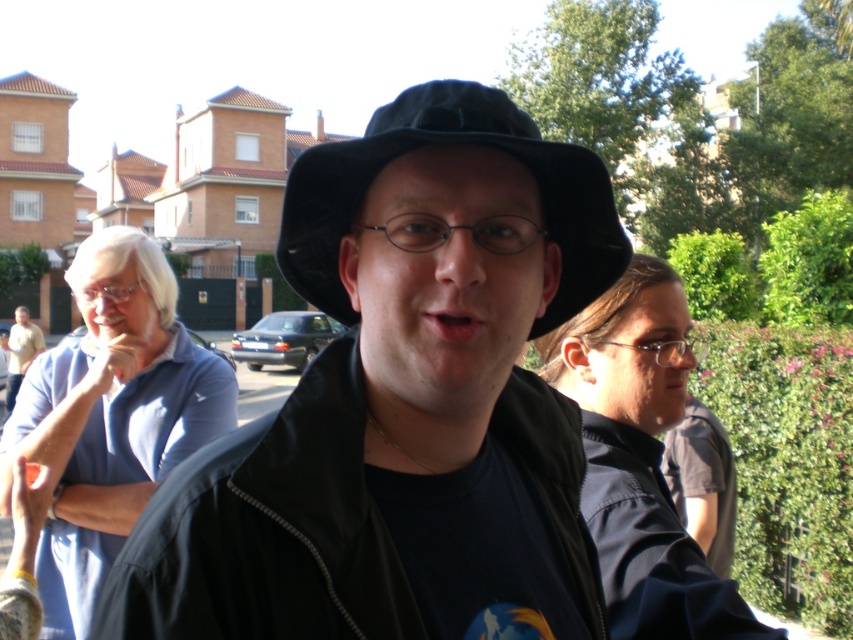
Does matte black jacket at center appear under pink matte lips at center?

Indeed, matte black jacket at center is positioned under pink matte lips at center.

From the picture: Does matte black jacket at center have a larger size compared to pink matte lips at center?

Correct, matte black jacket at center is larger in size than pink matte lips at center.

What are the coordinates of `matte black jacket at center` in the screenshot? It's located at (640, 458).

Can you confirm if black matte hat at center is positioned above matte black jacket at center?

Actually, black matte hat at center is below matte black jacket at center.

Measure the distance between point (259, 544) and camera.

They are 1.72 meters apart.

This screenshot has height=640, width=853. What are the coordinates of `black matte hat at center` in the screenshot? It's located at (387, 384).

Which is more to the left, blue cotton shirt at left or pink matte lips at center?

From the viewer's perspective, blue cotton shirt at left appears more on the left side.

Does blue cotton shirt at left have a lesser width compared to pink matte lips at center?

No.

Who is more forward, (148, 460) or (434, 337)?

Point (434, 337) is in front.

Image resolution: width=853 pixels, height=640 pixels. I want to click on blue cotton shirt at left, so click(x=109, y=417).